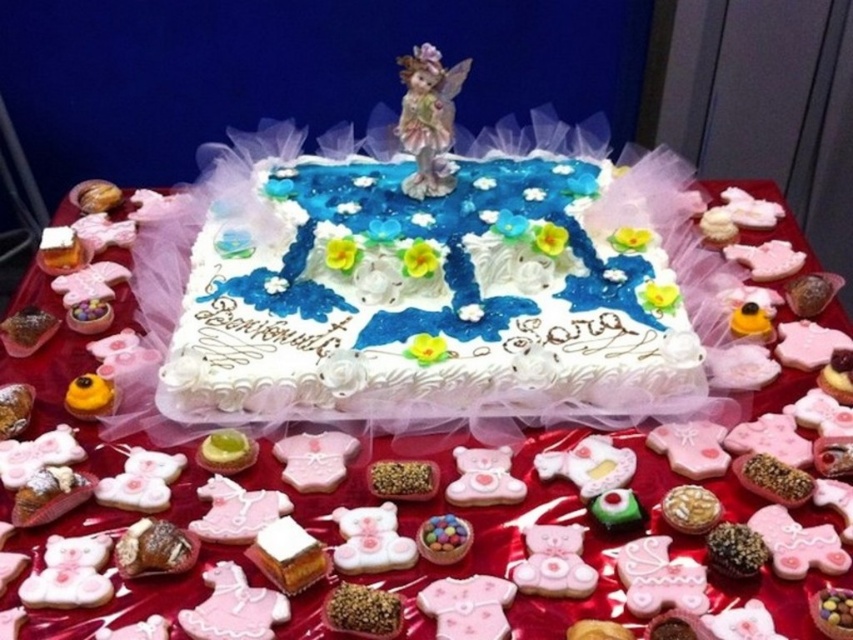
Question: Based on their relative distances, which object is farther from the white fondant cake at center?

Choices:
 (A) matte plastic eggs at center
 (B) white frosted cake at center

Answer: (A)

Question: Does white fondant cake at center appear on the right side of matte plastic eggs at center?

Choices:
 (A) no
 (B) yes

Answer: (B)

Question: Is white fondant cake at center thinner than matte plastic eggs at center?

Choices:
 (A) yes
 (B) no

Answer: (B)

Question: Can you confirm if white fondant cake at center is thinner than matte plastic eggs at center?

Choices:
 (A) yes
 (B) no

Answer: (B)

Question: Which object is farther from the camera taking this photo?

Choices:
 (A) matte plastic eggs at center
 (B) white fondant cake at center

Answer: (B)

Question: Estimate the real-world distances between objects in this image. Which object is farther from the matte plastic eggs at center?

Choices:
 (A) white frosted cake at center
 (B) white fondant cake at center

Answer: (B)